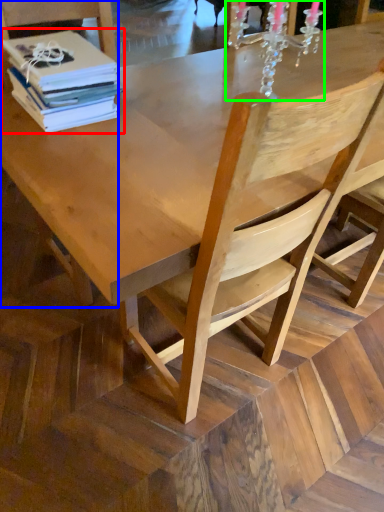
Question: Considering the real-world distances, which object is farthest from book (highlighted by a red box)? chair (highlighted by a blue box) or candle holder (highlighted by a green box)?

Choices:
 (A) chair
 (B) candle holder

Answer: (B)